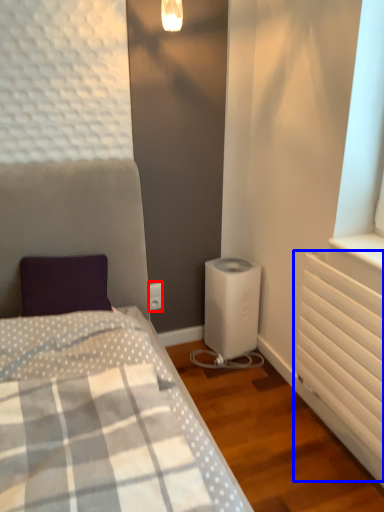
Question: Which object appears closest to the camera in this image, electric outlet (highlighted by a red box) or radiator (highlighted by a blue box)?

Choices:
 (A) electric outlet
 (B) radiator

Answer: (B)